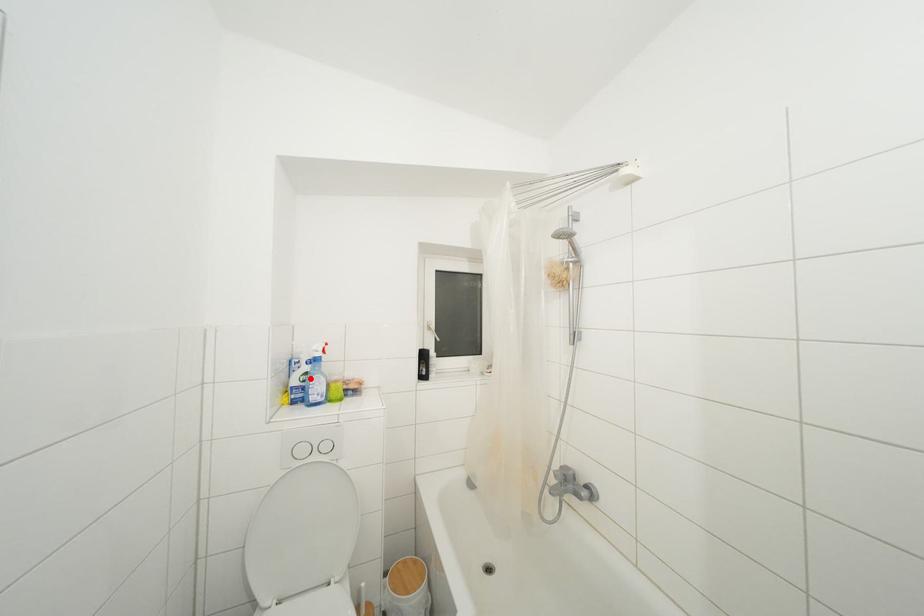
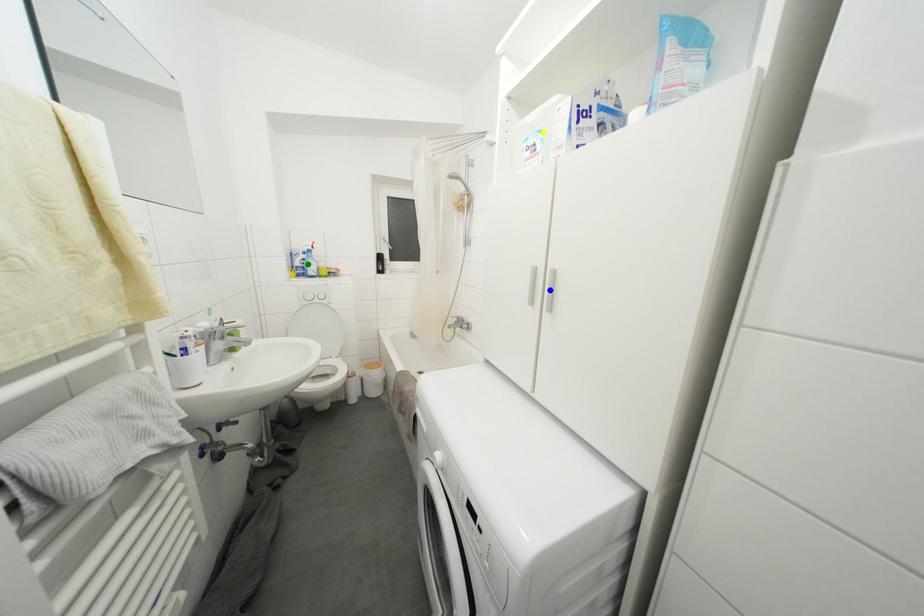
Question: I am providing you with two images of the same scene from different viewpoints. A red point is marked on the first image. You are given multiple points on the second image. In image 2, which mark is for the same physical point as the one in image 1?

Choices:
 (A) blue point
 (B) yellow point
 (C) green point

Answer: (C)